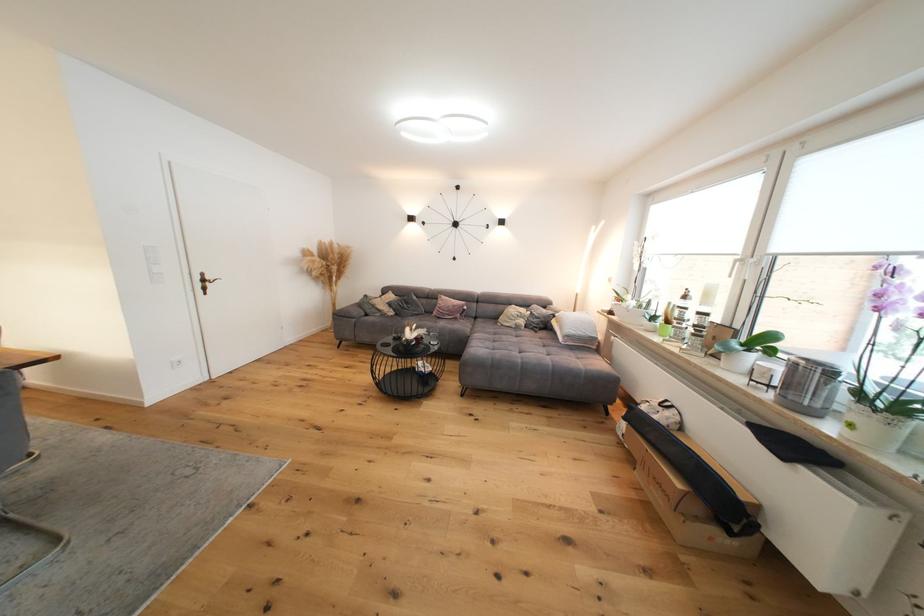
This screenshot has height=616, width=924. Identify the location of sofa armrest. (349, 310).